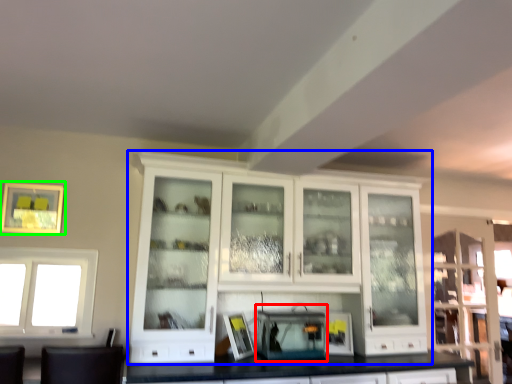
Question: Which object is positioned closest to appliance (highlighted by a red box)? Select from cabinetry (highlighted by a blue box) and picture frame (highlighted by a green box).

Choices:
 (A) cabinetry
 (B) picture frame

Answer: (A)